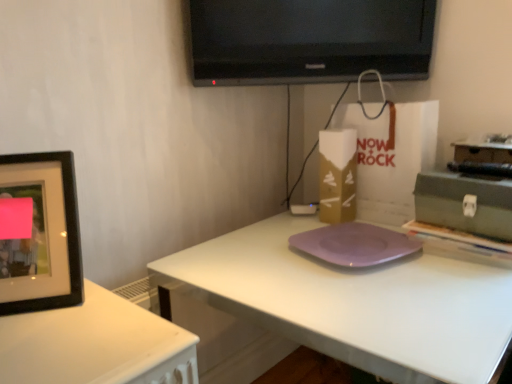
Question: Relative to purple matte plate at center, is black glossy tv at upper center in front or behind?

Choices:
 (A) behind
 (B) front

Answer: (A)

Question: Is point (224, 84) positioned closer to the camera than point (303, 337)?

Choices:
 (A) farther
 (B) closer

Answer: (A)

Question: Estimate the real-world distances between objects in this image. Which object is farther from the white paper bag at center?

Choices:
 (A) green matte toolbox at right
 (B) gold cardboard box at center
 (C) purple matte plate at center
 (D) black glossy tv at upper center
 (E) black matte picture frame at left

Answer: (E)

Question: Estimate the real-world distances between objects in this image. Which object is farther from the green matte toolbox at right?

Choices:
 (A) purple matte pad at center
 (B) black matte picture frame at left
 (C) white paper bag at center
 (D) purple matte plate at center
 (E) black glossy tv at upper center

Answer: (B)